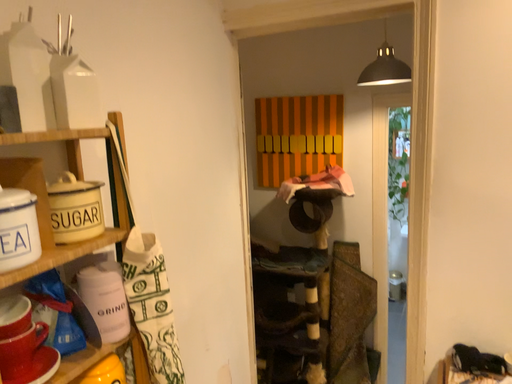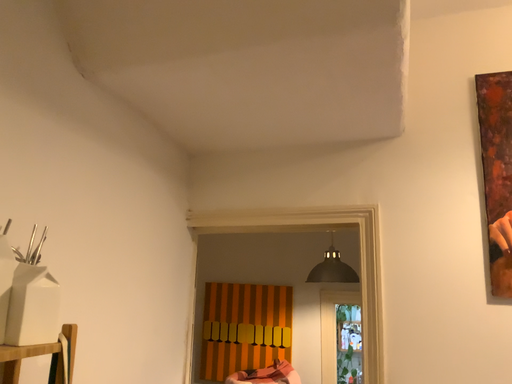
Question: Which way did the camera rotate in the video?

Choices:
 (A) rotated right
 (B) rotated left

Answer: (A)